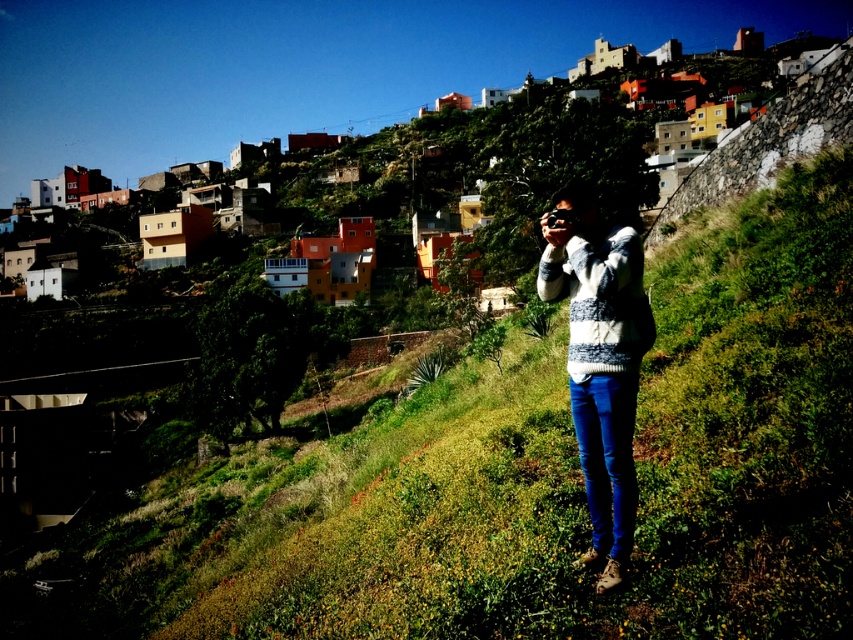
Question: Can you confirm if knitted sweater at center is positioned below blue denim jeans at center?

Choices:
 (A) yes
 (B) no

Answer: (B)

Question: Does knitted sweater at center come behind blue denim jeans at center?

Choices:
 (A) yes
 (B) no

Answer: (B)

Question: Is knitted sweater at center to the left of blue denim jeans at center from the viewer's perspective?

Choices:
 (A) yes
 (B) no

Answer: (B)

Question: Among these points, which one is farthest from the camera?

Choices:
 (A) (611, 460)
 (B) (552, 230)

Answer: (B)

Question: Which object is farther from the camera taking this photo?

Choices:
 (A) blue denim jeans at center
 (B) knitted sweater at center

Answer: (A)